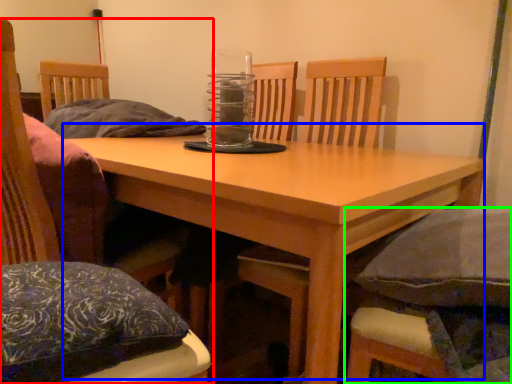
Question: Estimate the real-world distances between objects in this image. Which object is closer to chair (highlighted by a red box), table (highlighted by a blue box) or chair (highlighted by a green box)?

Choices:
 (A) table
 (B) chair

Answer: (A)